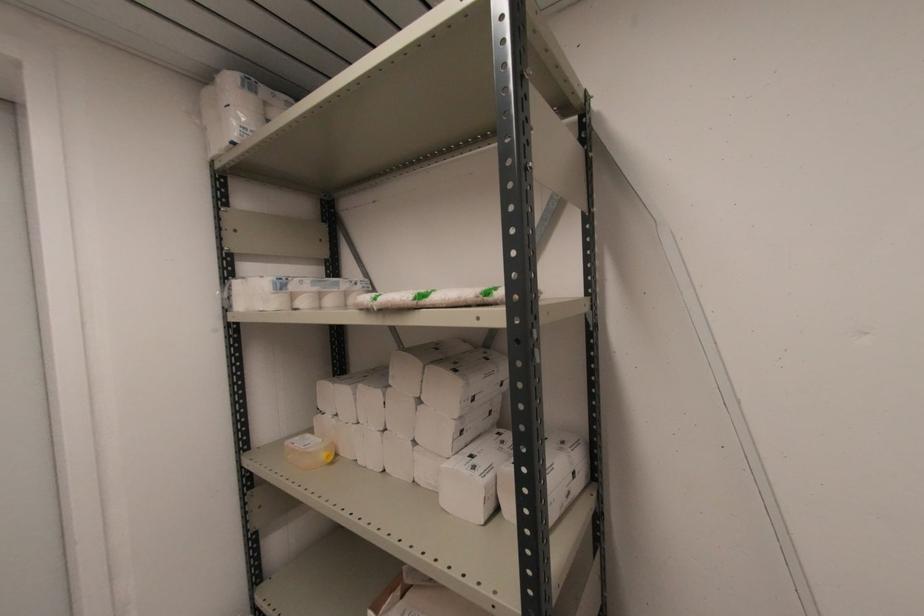
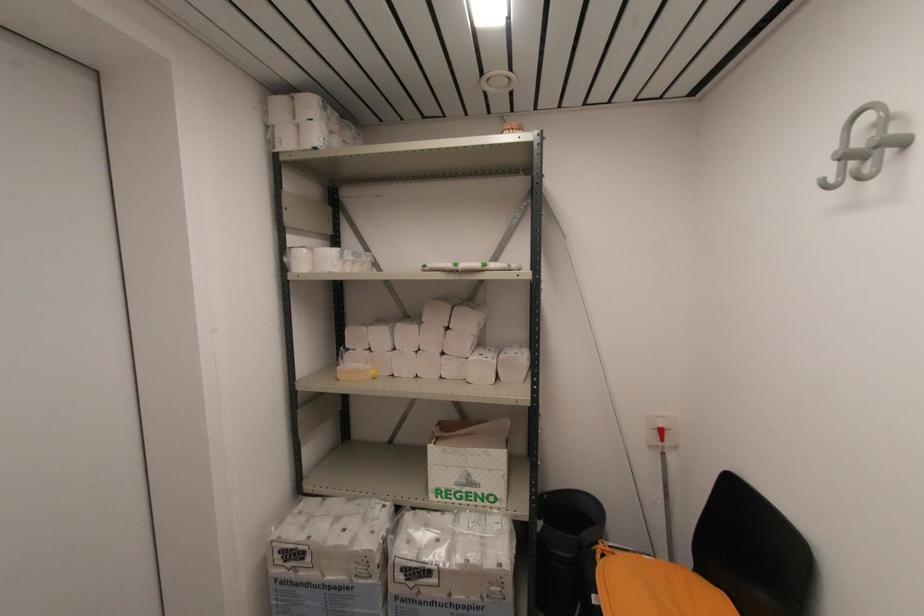
Find the pixel in the second image that matches point 227,144 in the first image.

(310, 148)